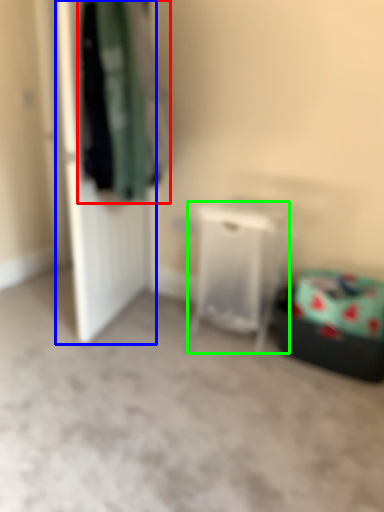
Question: Considering the real-world distances, which object is closest to clothing (highlighted by a red box)? door (highlighted by a blue box) or furniture (highlighted by a green box).

Choices:
 (A) door
 (B) furniture

Answer: (A)